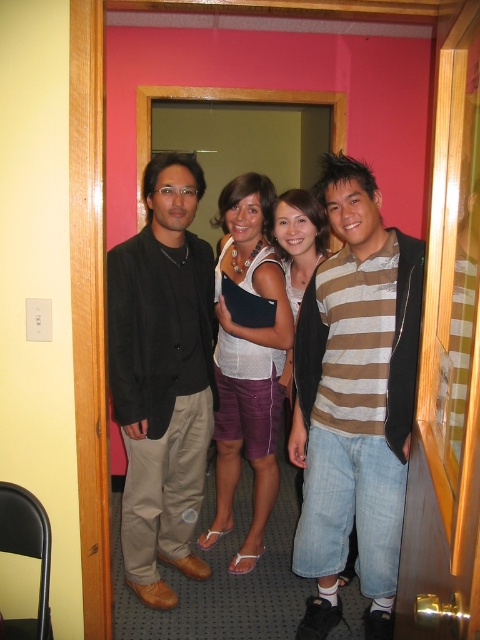
Question: Which point is closer to the camera?

Choices:
 (A) matte white tank top at center
 (B) brown striped shirt at center

Answer: (B)

Question: Where is brown striped shirt at center located in relation to matte white tank top at center in the image?

Choices:
 (A) above
 (B) below

Answer: (B)

Question: Does brown striped shirt at center appear over matte black blazer at left?

Choices:
 (A) yes
 (B) no

Answer: (B)

Question: Does brown striped shirt at center appear on the right side of matte white tank top at center?

Choices:
 (A) no
 (B) yes

Answer: (B)

Question: Which object is positioned closest to the brown striped shirt at center?

Choices:
 (A) matte black blazer at left
 (B) matte white tank top at center

Answer: (B)

Question: Estimate the real-world distances between objects in this image. Which object is closer to the brown striped shirt at center?

Choices:
 (A) matte white tank top at center
 (B) matte black blazer at left

Answer: (A)